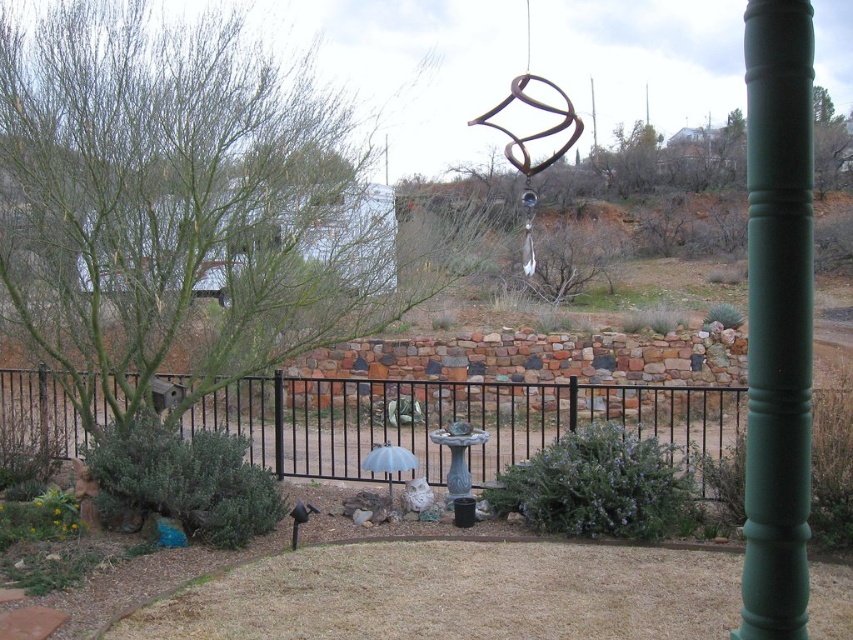
You are standing in the backyard and want to locate the black metal fence at center. According to the coordinates provided, where exactly should you look?

The black metal fence at center is located at coordinates point (462, 419).